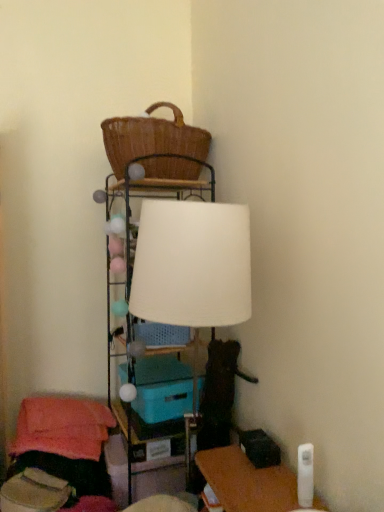
Question: Is teal plastic storage box at center positioned before white fabric lampshade at upper center?

Choices:
 (A) yes
 (B) no

Answer: (B)

Question: From the image's perspective, is teal plastic storage box at center over white fabric lampshade at upper center?

Choices:
 (A) no
 (B) yes

Answer: (A)

Question: Considering the relative sizes of teal plastic storage box at center and white fabric lampshade at upper center in the image provided, is teal plastic storage box at center taller than white fabric lampshade at upper center?

Choices:
 (A) yes
 (B) no

Answer: (B)

Question: Does teal plastic storage box at center contain white fabric lampshade at upper center?

Choices:
 (A) yes
 (B) no

Answer: (B)

Question: Is teal plastic storage box at center oriented towards white fabric lampshade at upper center?

Choices:
 (A) yes
 (B) no

Answer: (A)

Question: Is teal plastic storage box at center shorter than white fabric lampshade at upper center?

Choices:
 (A) yes
 (B) no

Answer: (A)

Question: Can you confirm if matte plastic table at center is smaller than woven brown basket at upper center?

Choices:
 (A) no
 (B) yes

Answer: (B)

Question: Can you confirm if matte plastic table at center is taller than woven brown basket at upper center?

Choices:
 (A) yes
 (B) no

Answer: (B)

Question: From a real-world perspective, is matte plastic table at center on woven brown basket at upper center?

Choices:
 (A) yes
 (B) no

Answer: (B)

Question: Would you say matte plastic table at center contains woven brown basket at upper center?

Choices:
 (A) no
 (B) yes

Answer: (A)

Question: Is woven brown basket at upper center at the back of matte plastic table at center?

Choices:
 (A) no
 (B) yes

Answer: (A)

Question: Is matte plastic table at center further to the viewer compared to woven brown basket at upper center?

Choices:
 (A) no
 (B) yes

Answer: (B)

Question: Are teal plastic storage box at center and woven brown basket at upper center located far from each other?

Choices:
 (A) no
 (B) yes

Answer: (A)